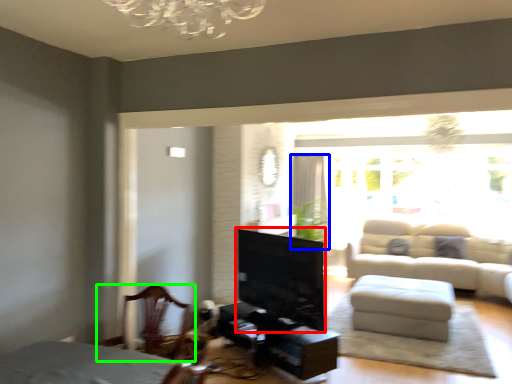
Question: Estimate the real-world distances between objects in this image. Which object is closer to fireplace (highlighted by a red box), curtain (highlighted by a blue box) or chair (highlighted by a green box)?

Choices:
 (A) curtain
 (B) chair

Answer: (B)